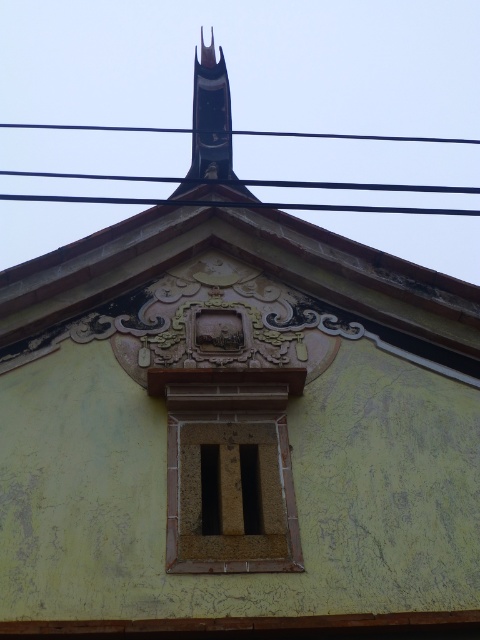
Question: Can you confirm if brown textured stone window at center is positioned to the right of black wire at upper center?

Choices:
 (A) no
 (B) yes

Answer: (B)

Question: Is brown textured stone window at center in front of black wire at upper center?

Choices:
 (A) no
 (B) yes

Answer: (B)

Question: Is brown textured stone window at center to the left of black wire at upper center from the viewer's perspective?

Choices:
 (A) no
 (B) yes

Answer: (A)